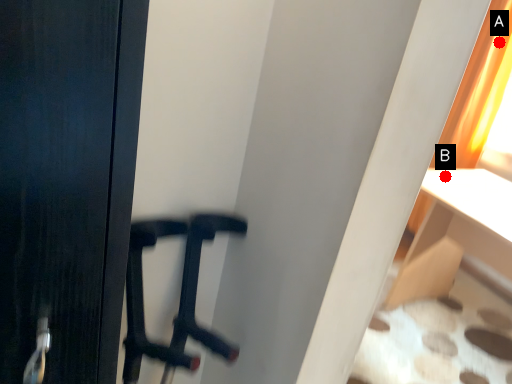
Question: Two points are circled on the image, labeled by A and B beside each circle. Which of the following is the farthest from the observer?

Choices:
 (A) A is further
 (B) B is further

Answer: (A)